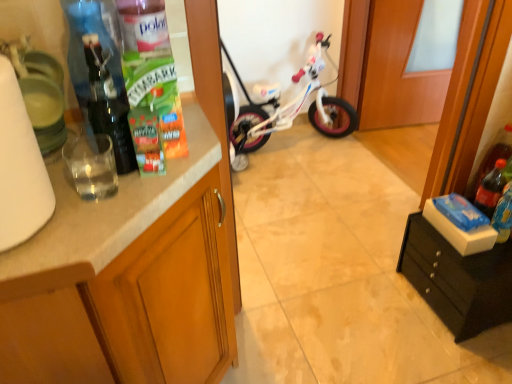
This screenshot has height=384, width=512. In order to click on free spot above blue cardboard box at right (from a real-world perspective) in this screenshot , I will do `click(460, 215)`.